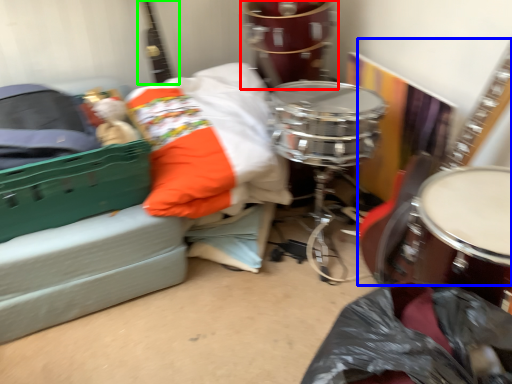
Question: Based on their relative distances, which object is nearer to drum (highlighted by a red box)? Choose from guitar (highlighted by a blue box) and guitar (highlighted by a green box).

Choices:
 (A) guitar
 (B) guitar

Answer: (B)